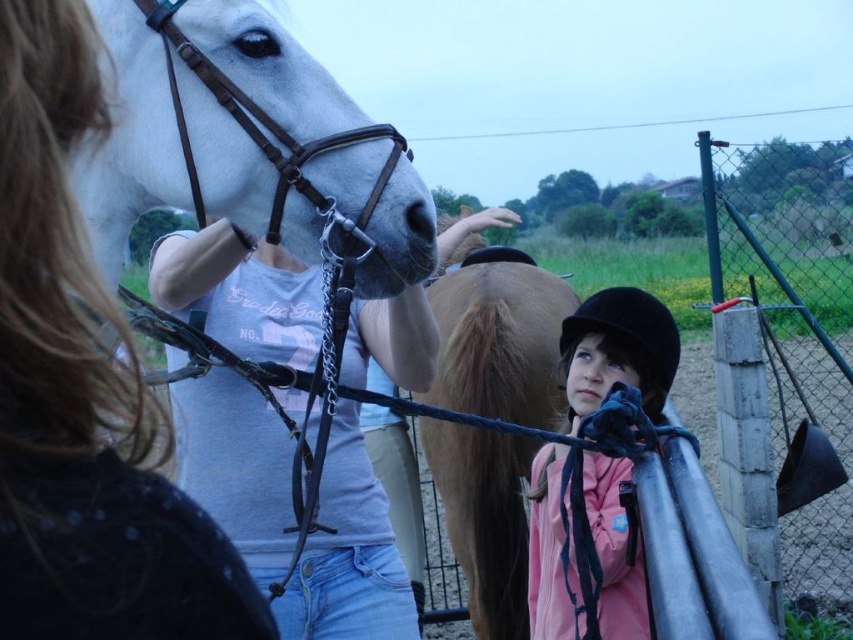
You are a photographer standing in front of the matte white horse at left and the white leather bridle at upper left. You want to take a photo of the horse but need to avoid the bridle appearing too large in the frame. Which object should you focus on to ensure the horse is the main subject?

The matte white horse at left is closer to the viewer than the white leather bridle at upper left. To ensure the horse is the main subject and the bridle doesn not appear too large, focus on the matte white horse at left since it is closer and will appear larger in the frame compared to the bridle.

You are a photographer trying to capture the white leather bridle at upper left in the scene. If you want to focus on the bridle, which part of the image should you adjust your camera to point towards?

The white leather bridle at upper left is located at point (294, 145), so you should adjust your camera to point towards the coordinates (294, 145) to focus on it.

You are a photographer standing in front of the matte white horse at left. You want to take a photo of it but need to ensure you are at a safe distance. According to guidelines, you must stay at least 20 inches away from horses to avoid startling them. Are you within the safe distance?

The matte white horse at left is 19.44 inches away from viewer. Since 19.44 inches is less than the required 20 inches, you are too close and should move back to ensure safety.